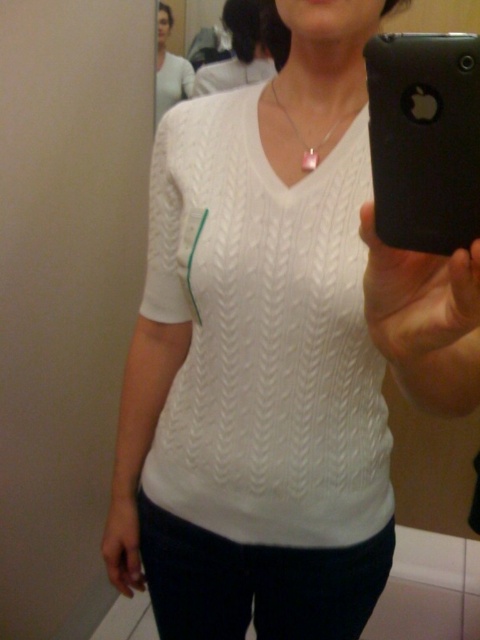
You are trying to take a photo of the black plastic phone at upper right but want to avoid capturing the person in the mirror selfie. Where should you position yourself relative to the point at coordinates point (424, 140) to ensure the phone is visible without the person in the frame?

Position yourself to the left of the point at coordinates point (424, 140) to capture the black plastic phone at upper right without the person in the mirror selfie.

You are standing in a bathroom and see a mirror selfie setup with a white knitted shirt at center and a white knitted sweater at upper center. Which item is positioned more to the left in the mirror reflection?

The white knitted sweater at upper center is positioned more to the left because the white knitted shirt at center is to the right of it.

You are standing at the point marked as point (179,81) in the bathroom. You want to take a selfie using a camera that requires you to be at least 1.5 meters away from the subject to focus properly. Can you take a clear photo of the person in the mirror using the camera from your current position?

The distance between point (179,81) and the camera is 1.75 meters, which is more than the required 1.5 meters. Therefore, you can take a clear photo of the person in the mirror from your current position.